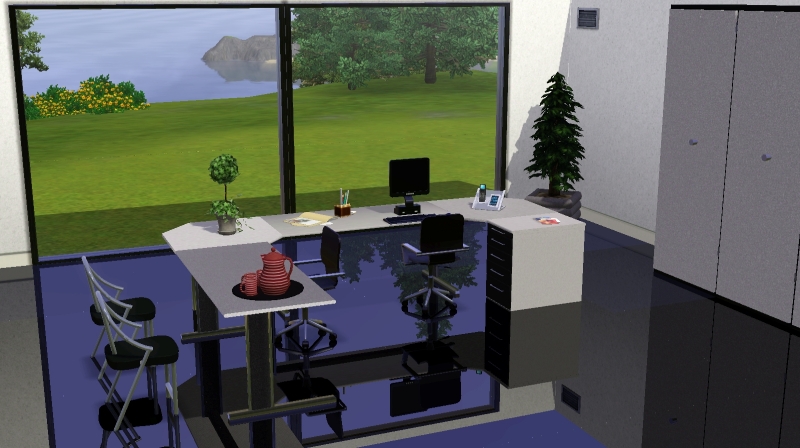
You are a GUI agent. You are given a task and a screenshot of the screen. Output one action in this format:
    pyautogui.click(x=<x>, y=<y>)
    Task: Click on the chair
    The width and height of the screenshot is (800, 448).
    Given the screenshot: What is the action you would take?
    pyautogui.click(x=440, y=235), pyautogui.click(x=328, y=250), pyautogui.click(x=122, y=308), pyautogui.click(x=140, y=357)